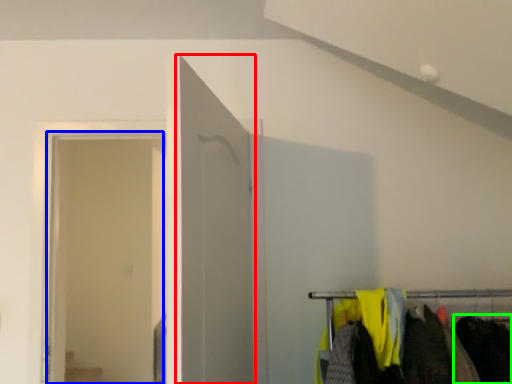
Question: Which is nearer to the door (highlighted by a red box)? glass door (highlighted by a blue box) or clothing (highlighted by a green box).

Choices:
 (A) glass door
 (B) clothing

Answer: (B)